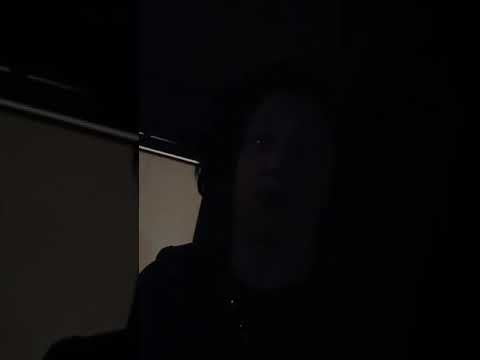
The image size is (480, 360). Find the location of `white horizontal line left wall`. white horizontal line left wall is located at coordinates point(98,128).